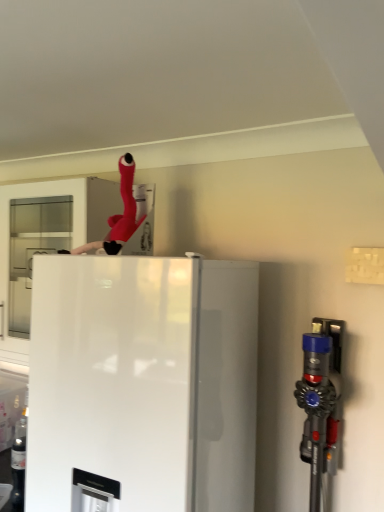
Question: Is blue plastic vacuum cleaner at right at the right side of rubberized red hose at upper center?

Choices:
 (A) no
 (B) yes

Answer: (B)

Question: Does blue plastic vacuum cleaner at right have a lesser height compared to rubberized red hose at upper center?

Choices:
 (A) no
 (B) yes

Answer: (A)

Question: Are blue plastic vacuum cleaner at right and rubberized red hose at upper center beside each other?

Choices:
 (A) no
 (B) yes

Answer: (A)

Question: From a real-world perspective, is blue plastic vacuum cleaner at right on rubberized red hose at upper center?

Choices:
 (A) yes
 (B) no

Answer: (B)

Question: Is blue plastic vacuum cleaner at right closer to the viewer compared to rubberized red hose at upper center?

Choices:
 (A) yes
 (B) no

Answer: (A)

Question: Is blue plastic vacuum cleaner at right spatially inside rubberized red hose at upper center, or outside of it?

Choices:
 (A) inside
 (B) outside

Answer: (B)

Question: Is blue plastic vacuum cleaner at right in front of or behind rubberized red hose at upper center in the image?

Choices:
 (A) behind
 (B) front

Answer: (B)

Question: Considering the positions of point (304, 421) and point (92, 247), is point (304, 421) closer or farther from the camera than point (92, 247)?

Choices:
 (A) closer
 (B) farther

Answer: (B)

Question: Considering the positions of blue plastic vacuum cleaner at right and rubberized red hose at upper center in the image, is blue plastic vacuum cleaner at right taller or shorter than rubberized red hose at upper center?

Choices:
 (A) short
 (B) tall

Answer: (B)

Question: Visually, is rubberized red hose at upper center positioned to the left or to the right of white glossy refrigerator at center?

Choices:
 (A) left
 (B) right

Answer: (A)

Question: Is rubberized red hose at upper center taller or shorter than white glossy refrigerator at center?

Choices:
 (A) tall
 (B) short

Answer: (B)

Question: Would you say rubberized red hose at upper center is inside or outside white glossy refrigerator at center?

Choices:
 (A) inside
 (B) outside

Answer: (B)

Question: Based on their sizes in the image, would you say rubberized red hose at upper center is bigger or smaller than white glossy refrigerator at center?

Choices:
 (A) small
 (B) big

Answer: (A)

Question: Which is correct: rubberized red hose at upper center is inside blue plastic vacuum cleaner at right, or outside of it?

Choices:
 (A) inside
 (B) outside

Answer: (B)

Question: From the image's perspective, is rubberized red hose at upper center located above or below blue plastic vacuum cleaner at right?

Choices:
 (A) above
 (B) below

Answer: (A)